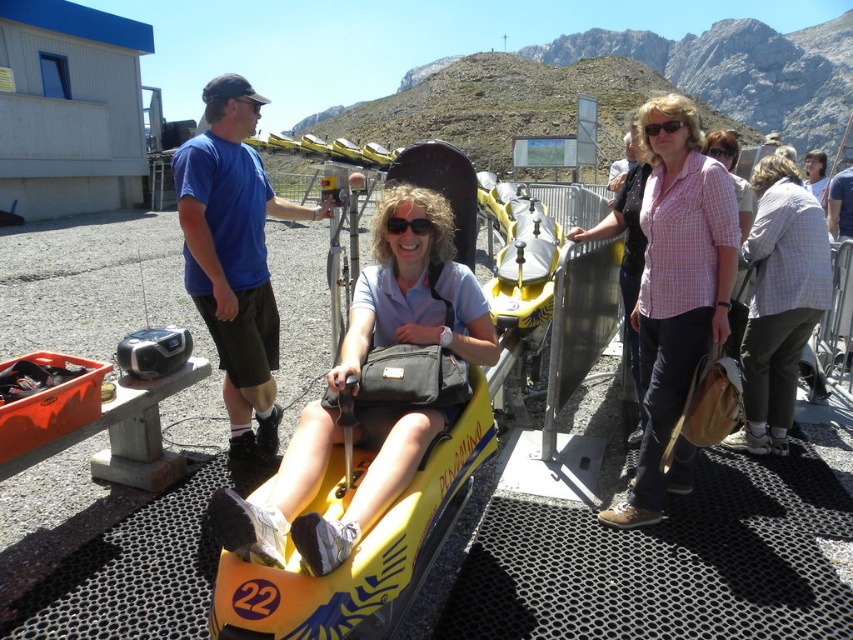
How distant is matte yellow sled at center from matte black sunglasses at center?

matte yellow sled at center and matte black sunglasses at center are 1.91 meters apart from each other.

From the picture: Can you confirm if matte yellow sled at center is positioned to the left of matte black sunglasses at center?

Yes, matte yellow sled at center is to the left of matte black sunglasses at center.

I want to click on matte yellow sled at center, so click(318, 484).

Between point (817, 163) and point (241, 100), which one is positioned in front?

Point (241, 100) is in front.

Does matte pink shirt at center come behind black matte goggles at upper center?

Yes.

Measure the distance between matte pink shirt at center and camera.

matte pink shirt at center and camera are 7.12 meters apart from each other.

Find the location of a particular element. The width and height of the screenshot is (853, 640). matte pink shirt at center is located at coordinates (816, 173).

Is blue cotton shirt at left above black matte goggles at upper center?

Actually, blue cotton shirt at left is below black matte goggles at upper center.

Does point (224, 97) come closer to viewer compared to point (254, 99)?

That is True.

This screenshot has width=853, height=640. I want to click on blue cotton shirt at left, so click(x=234, y=259).